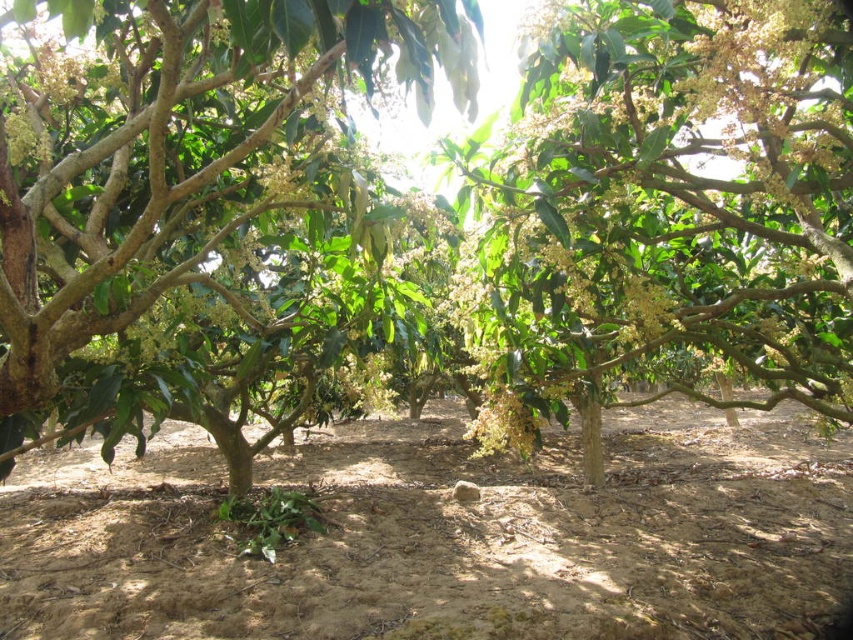
Question: Which point is closer to the camera?

Choices:
 (A) brown soil at center
 (B) green leafy tree at center

Answer: (B)

Question: Which point is closer to the camera taking this photo?

Choices:
 (A) [x=421, y=464]
 (B) [x=352, y=173]

Answer: (B)

Question: Can you confirm if green leafy tree at center is positioned above green glossy tree at upper center?

Choices:
 (A) yes
 (B) no

Answer: (A)

Question: Can you confirm if brown soil at center is positioned to the left of green leafy tree at center?

Choices:
 (A) no
 (B) yes

Answer: (A)

Question: Which point appears closest to the camera in this image?

Choices:
 (A) pyautogui.click(x=351, y=570)
 (B) pyautogui.click(x=834, y=330)

Answer: (A)

Question: Considering the relative positions of green leafy tree at center and green glossy tree at upper center in the image provided, where is green leafy tree at center located with respect to green glossy tree at upper center?

Choices:
 (A) right
 (B) left

Answer: (B)